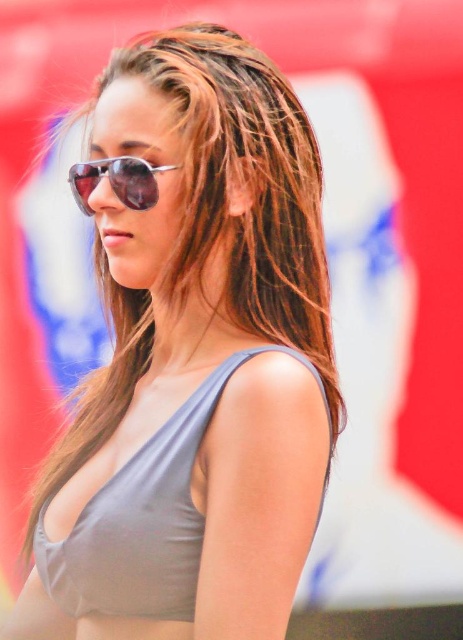
Consider the image. Can you confirm if matte gray bikini top at center is wider than shiny metallic aviator sunglasses at center?

Yes, matte gray bikini top at center is wider than shiny metallic aviator sunglasses at center.

Who is more forward, (x=92, y=545) or (x=150, y=180)?

Positioned in front is point (x=92, y=545).

The image size is (463, 640). What do you see at coordinates (143, 520) in the screenshot?
I see `matte gray bikini top at center` at bounding box center [143, 520].

Locate an element on the screen. matte gray bikini top at center is located at coordinates (143, 520).

Looking at this image, is matte gray tank top at center smaller than shiny metallic aviator sunglasses at center?

No.

Who is higher up, matte gray tank top at center or shiny metallic aviator sunglasses at center?

shiny metallic aviator sunglasses at center

Where is `matte gray tank top at center`? The image size is (463, 640). matte gray tank top at center is located at coordinates (194, 358).

I want to click on matte gray tank top at center, so pyautogui.click(x=194, y=358).

Between matte gray bikini top at center and matte gray belly at center, which one is positioned lower?

matte gray belly at center is lower down.

Is point (152, 556) behind point (89, 616)?

No, it is in front of (89, 616).

Image resolution: width=463 pixels, height=640 pixels. Find the location of `matte gray bikini top at center`. matte gray bikini top at center is located at coordinates (143, 520).